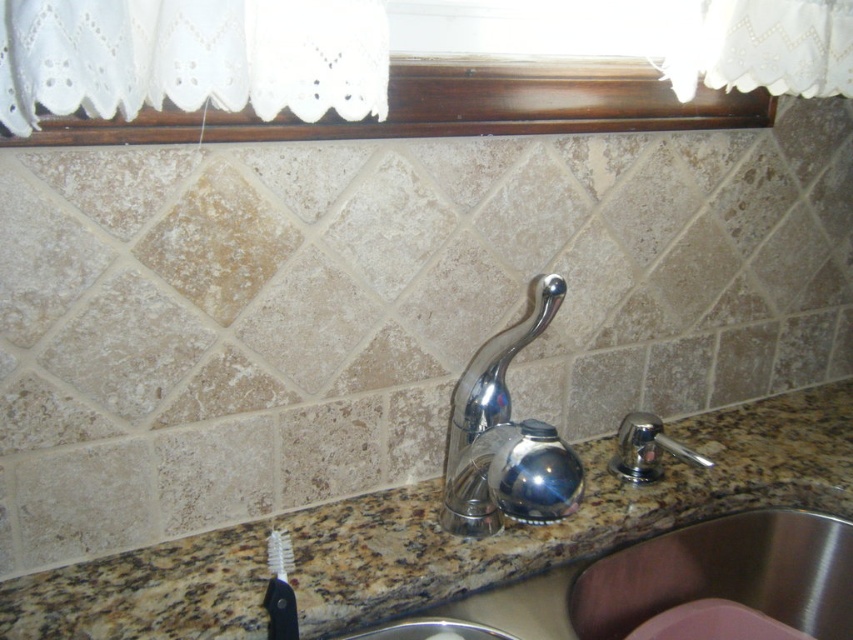
Who is lower down, dark wood window sill at upper center or white bristle toothbrush at lower left?

white bristle toothbrush at lower left

Looking at this image, is dark wood window sill at upper center smaller than white bristle toothbrush at lower left?

No.

Between point (599, 88) and point (277, 616), which one is positioned in front?

Point (277, 616) is in front.

I want to click on dark wood window sill at upper center, so click(450, 108).

Is point (757, 435) closer to camera compared to point (628, 474)?

No, (757, 435) is further to viewer.

Identify the location of granite at center. (572, 515).

Locate an element on the screen. The width and height of the screenshot is (853, 640). granite at center is located at coordinates tap(572, 515).

Is granite at center to the right of white bristle toothbrush at lower left from the viewer's perspective?

Correct, you'll find granite at center to the right of white bristle toothbrush at lower left.

Which is below, granite at center or white bristle toothbrush at lower left?

white bristle toothbrush at lower left is below.

Is point (759, 467) positioned after point (287, 609)?

Yes, point (759, 467) is behind point (287, 609).

Where is `granite at center`? The image size is (853, 640). granite at center is located at coordinates (572, 515).